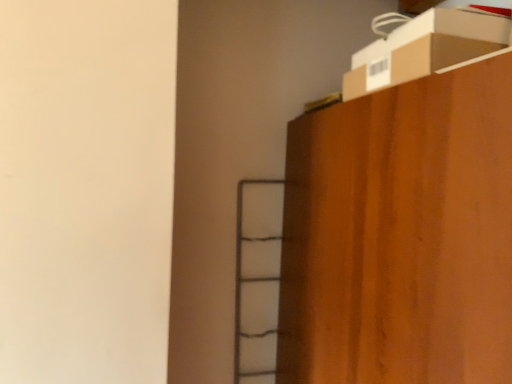
Question: In terms of height, does brown cardboard box at upper right look taller or shorter compared to wooden cabinet at upper right?

Choices:
 (A) tall
 (B) short

Answer: (B)

Question: Is point (466, 43) closer or farther from the camera than point (288, 253)?

Choices:
 (A) closer
 (B) farther

Answer: (A)

Question: Looking at their shapes, would you say brown cardboard box at upper right is wider or thinner than wooden cabinet at upper right?

Choices:
 (A) thin
 (B) wide

Answer: (A)

Question: Is wooden cabinet at upper right situated inside brown cardboard box at upper right or outside?

Choices:
 (A) inside
 (B) outside

Answer: (B)

Question: In terms of width, does wooden cabinet at upper right look wider or thinner when compared to brown cardboard box at upper right?

Choices:
 (A) wide
 (B) thin

Answer: (A)

Question: From a real-world perspective, is wooden cabinet at upper right physically located above or below brown cardboard box at upper right?

Choices:
 (A) below
 (B) above

Answer: (A)

Question: Considering the positions of point (401, 263) and point (463, 46), is point (401, 263) closer or farther from the camera than point (463, 46)?

Choices:
 (A) farther
 (B) closer

Answer: (B)